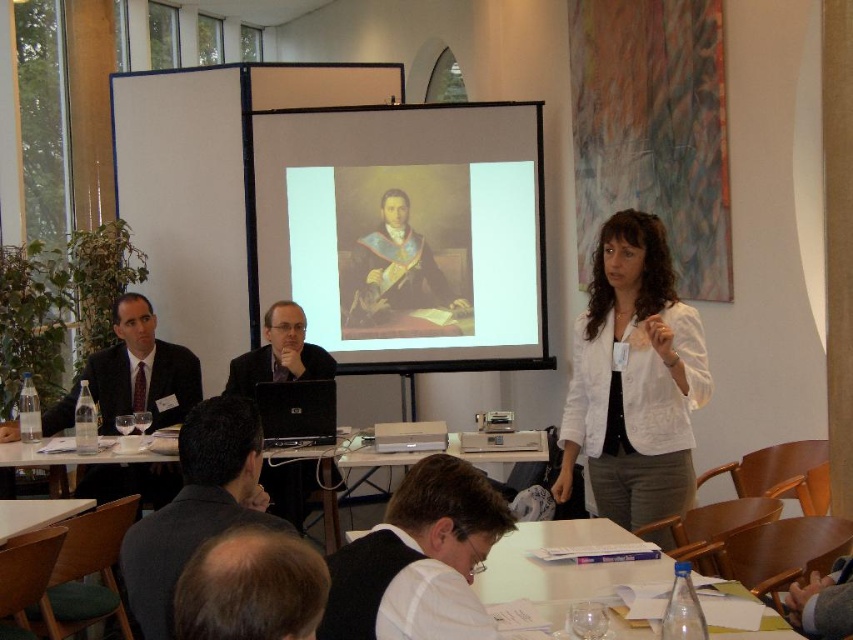
Question: Is dark gray sweater at center to the right of white plastic table at center from the viewer's perspective?

Choices:
 (A) yes
 (B) no

Answer: (A)

Question: Among these objects, which one is nearest to the camera?

Choices:
 (A) matte canvas projection screen at center
 (B) clear plastic water bottle at lower center
 (C) white matte table at lower left

Answer: (B)

Question: Does dark gray sweater at center appear on the right side of clear plastic water bottle at lower center?

Choices:
 (A) no
 (B) yes

Answer: (A)

Question: Does white shirt at lower center have a lesser width compared to dark gray sweater at center?

Choices:
 (A) no
 (B) yes

Answer: (B)

Question: Estimate the real-world distances between objects in this image. Which object is farther from the dark gray sweater at center?

Choices:
 (A) clear plastic water bottle at lower center
 (B) matte canvas projection screen at center
 (C) dark suit at left
 (D) white textured blazer at center

Answer: (B)

Question: Which of these objects is positioned closest to the white matte table at lower left?

Choices:
 (A) black plastic laptop at center
 (B) clear plastic water bottle at lower center
 (C) white textured blazer at center

Answer: (A)